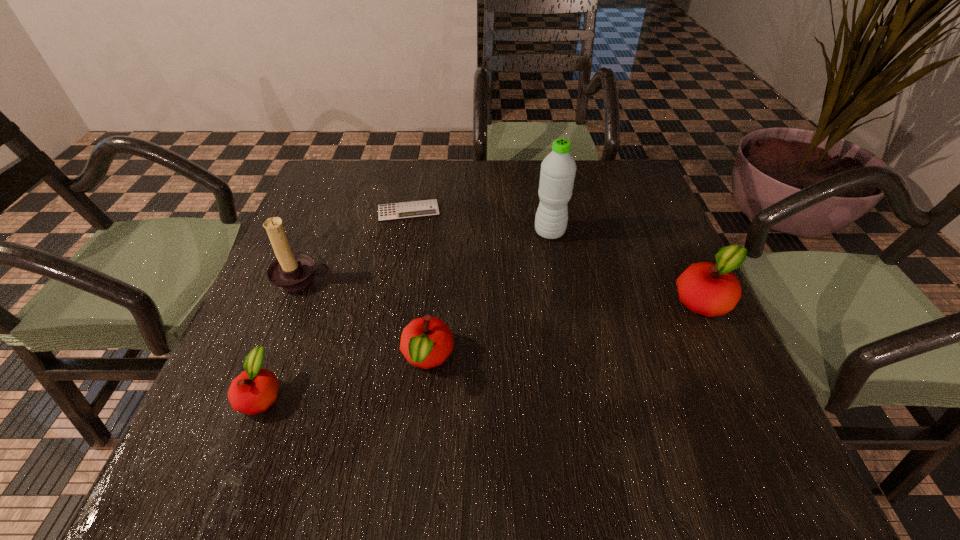
If the aim is uniform spacing by inserting an additional apple among them, please point to a vacant space for this new apple. Please provide its 2D coordinates. Your answer should be formatted as a tuple, i.e. [(x, y)], where the tuple contains the x and y coordinates of a point satisfying the conditions above.

[(574, 328)]